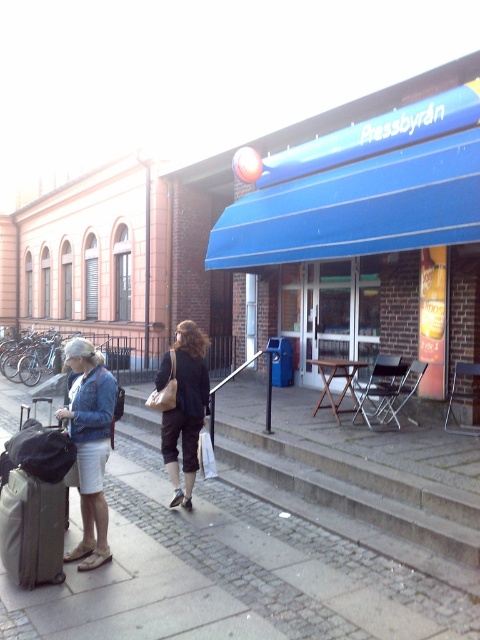
Question: Which point is farther to the camera?

Choices:
 (A) cobblestone pavement at lower left
 (B) denim jacket at left
 (C) matte black pants at center

Answer: (C)

Question: Is cobblestone pavement at lower left above matte black pants at center?

Choices:
 (A) yes
 (B) no

Answer: (B)

Question: Can you confirm if blue awning at center is positioned above matte black pants at center?

Choices:
 (A) no
 (B) yes

Answer: (B)

Question: Observing the image, what is the correct spatial positioning of blue awning at center in reference to cobblestone pavement at lower left?

Choices:
 (A) left
 (B) right

Answer: (B)

Question: Estimate the real-world distances between objects in this image. Which object is closer to the matte black pants at center?

Choices:
 (A) cobblestone pavement at lower left
 (B) matte gray suitcase at lower left
 (C) denim jacket at left
 (D) blue awning at center

Answer: (A)

Question: Among these objects, which one is nearest to the camera?

Choices:
 (A) blue awning at center
 (B) matte black pants at center
 (C) denim jacket at left

Answer: (C)